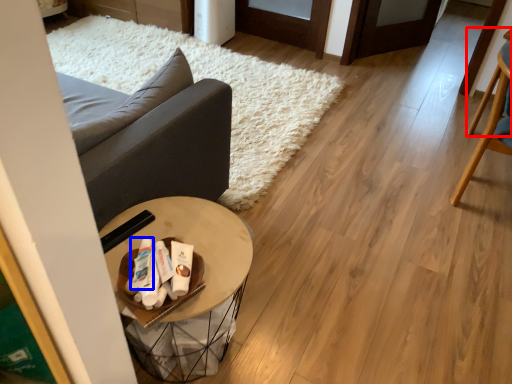
Question: Which object is further to the camera taking this photo, chair (highlighted by a red box) or toiletry (highlighted by a blue box)?

Choices:
 (A) chair
 (B) toiletry

Answer: (A)